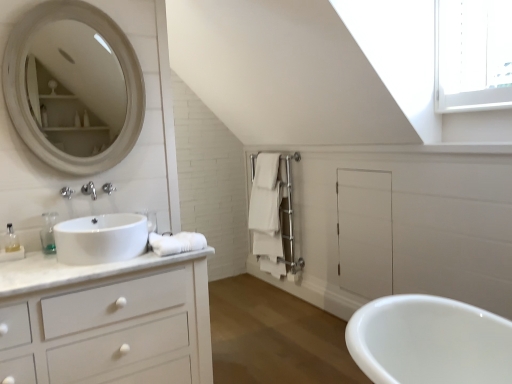
Question: From the image's perspective, is white matte towel at center-right, which is counted as the 2th bath towel, starting from the front, below translucent plastic soap dispenser at left, the first toiletry positioned from the left?

Choices:
 (A) no
 (B) yes

Answer: (A)

Question: Does white matte towel at center-right, placed as the first bath towel when sorted from right to left, turn towards translucent plastic soap dispenser at left, the first toiletry positioned from the left?

Choices:
 (A) no
 (B) yes

Answer: (B)

Question: Is white matte towel at center-right, which appears as the first bath towel when viewed from the top, not within translucent plastic soap dispenser at left, which is counted as the first toiletry, starting from the front?

Choices:
 (A) no
 (B) yes

Answer: (B)

Question: Can you confirm if white matte towel at center-right, the second bath towel viewed from the left, is bigger than translucent plastic soap dispenser at left, marked as the 3th toiletry in a right-to-left arrangement?

Choices:
 (A) yes
 (B) no

Answer: (A)

Question: Considering the relative positions of white matte towel at center-right, which is counted as the 2th bath towel, starting from the front, and translucent plastic soap dispenser at left, the first toiletry positioned from the left, in the image provided, is white matte towel at center-right, which is counted as the 2th bath towel, starting from the front, to the right of translucent plastic soap dispenser at left, the first toiletry positioned from the left, from the viewer's perspective?

Choices:
 (A) no
 (B) yes

Answer: (B)

Question: Is white matte towel at center-right, which appears as the first bath towel when viewed from the top, not near translucent plastic soap dispenser at left, marked as the 3th toiletry in a right-to-left arrangement?

Choices:
 (A) yes
 (B) no

Answer: (A)

Question: From the image's perspective, is translucent plastic bottle at left, the 2th toiletry when ordered from right to left, located above white cotton bath towel at lower left, the second bath towel viewed from the top?

Choices:
 (A) yes
 (B) no

Answer: (A)

Question: Does translucent plastic bottle at left, which is the 2th toiletry from left to right, come in front of white cotton bath towel at lower left, the 2th bath towel in the right-to-left sequence?

Choices:
 (A) yes
 (B) no

Answer: (B)

Question: Can you confirm if translucent plastic bottle at left, the 2th toiletry in the front-to-back sequence, is thinner than white cotton bath towel at lower left, which is counted as the 2th bath towel, starting from the back?

Choices:
 (A) no
 (B) yes

Answer: (B)

Question: Is translucent plastic bottle at left, the 2th toiletry in the back-to-front sequence, taller than white cotton bath towel at lower left, the 2th bath towel in the right-to-left sequence?

Choices:
 (A) yes
 (B) no

Answer: (A)

Question: Is translucent plastic bottle at left, the 2th toiletry in the front-to-back sequence, oriented away from white cotton bath towel at lower left, the first bath towel positioned from the left?

Choices:
 (A) no
 (B) yes

Answer: (A)

Question: Can you confirm if translucent plastic bottle at left, which is the 2th toiletry from left to right, is wider than white cotton bath towel at lower left, the 1th bath towel positioned from the bottom?

Choices:
 (A) no
 (B) yes

Answer: (A)

Question: Is white matte cabinet at left not close to translucent plastic bottle at left, the 2th toiletry in the back-to-front sequence?

Choices:
 (A) no
 (B) yes

Answer: (A)